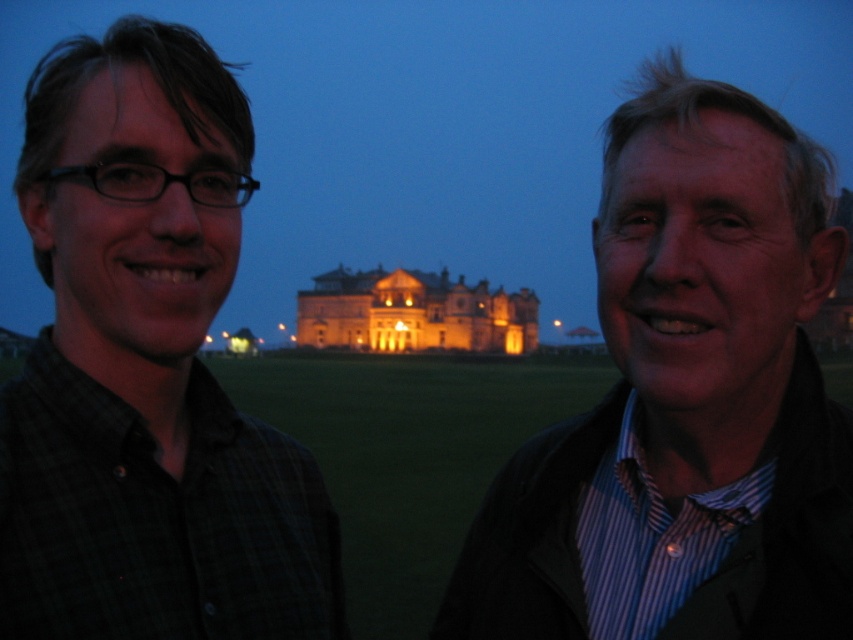
This screenshot has width=853, height=640. What are the coordinates of `striped shirt at center` in the screenshot? It's located at (685, 401).

Is striped shirt at center positioned at the back of checkered shirt at left?

That is True.

Does point (491, 483) come in front of point (294, 630)?

No, (491, 483) is further to viewer.

Find the location of a particular element. striped shirt at center is located at coordinates (685, 401).

Between checkered shirt at left and golden illuminated palace at center, which one is positioned lower?

checkered shirt at left is below.

What do you see at coordinates (146, 369) in the screenshot? The height and width of the screenshot is (640, 853). I see `checkered shirt at left` at bounding box center [146, 369].

Where is `checkered shirt at left`? The width and height of the screenshot is (853, 640). checkered shirt at left is located at coordinates (146, 369).

Is point (840, 248) closer to camera compared to point (325, 346)?

Yes, it is in front of point (325, 346).

Which is more to the left, striped shirt at center or golden illuminated palace at center?

From the viewer's perspective, golden illuminated palace at center appears more on the left side.

Which is in front, point (839, 513) or point (363, 314)?

Point (839, 513) is more forward.

Where is `striped shirt at center`? The height and width of the screenshot is (640, 853). striped shirt at center is located at coordinates (685, 401).